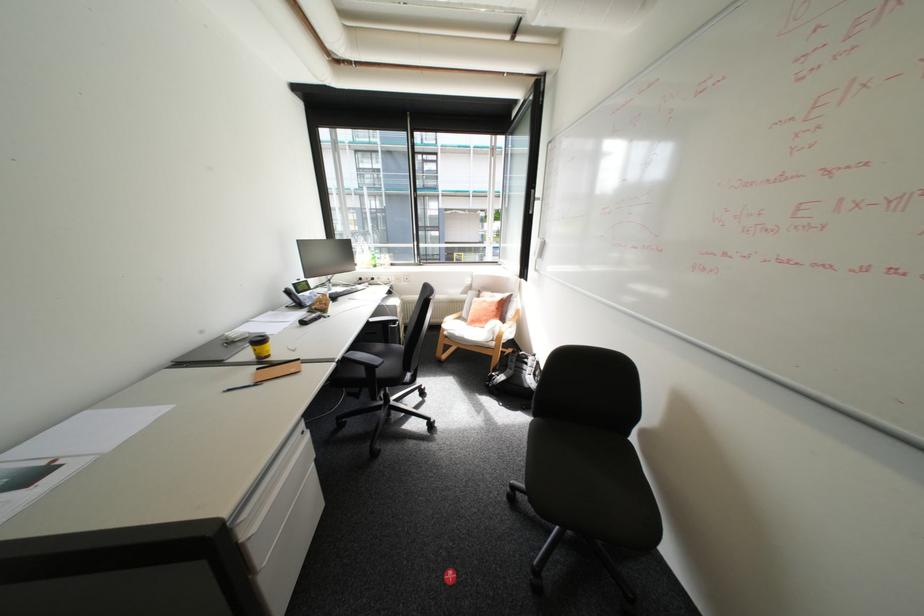
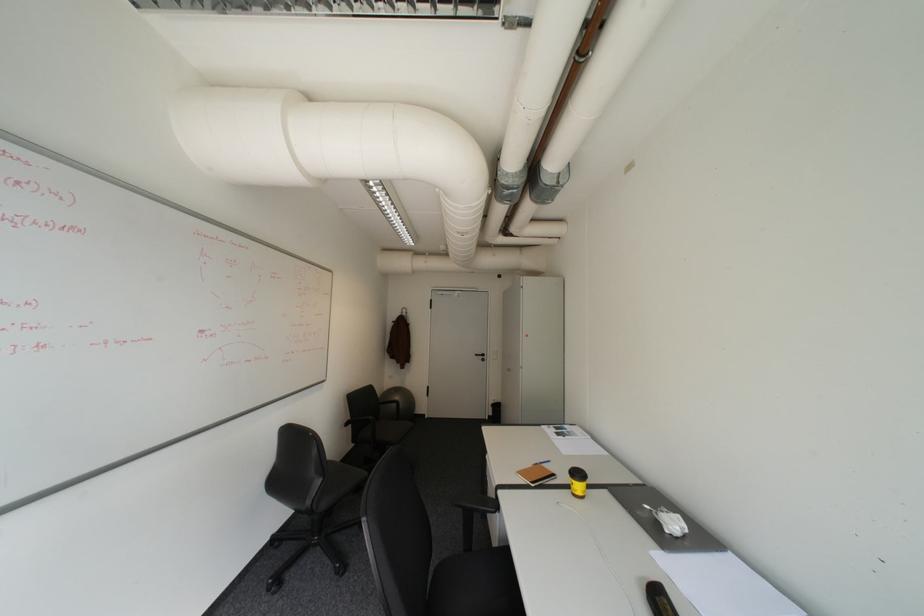
The point at (271, 384) is marked in the first image. Where is the corresponding point in the second image?

(543, 464)